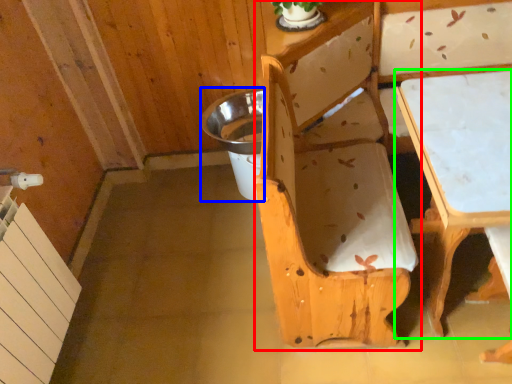
Question: Which object is the closest to the chair (highlighted by a red box)? Choose among these: potty (highlighted by a blue box) or table (highlighted by a green box).

Choices:
 (A) potty
 (B) table

Answer: (B)